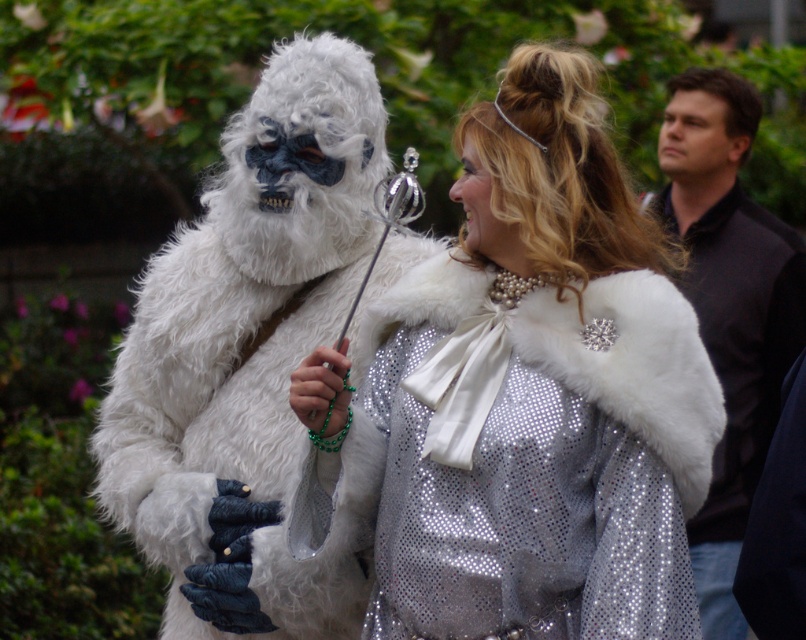
You are organizing a parade float and need to ensure that the shiny silver cape at center and the white furry coat at center can fit side by side. Based on their widths, will they both fit if the space allocated is 1.8 meters wide?

The shiny silver cape at center might be wider than the white furry coat at center. If the cape is wider, their combined width could exceed 1.8 meters, so there might not be enough space. Measure both to confirm.

You are trying to decide which item to store first in a narrow closet. You have the shiny silver cape at center and the dark brown shirt at right. Based on their sizes, which should you put in first?

The shiny silver cape at center might be wider than the dark brown shirt at right, so you should store the dark brown shirt at right first to save space for the wider cape.